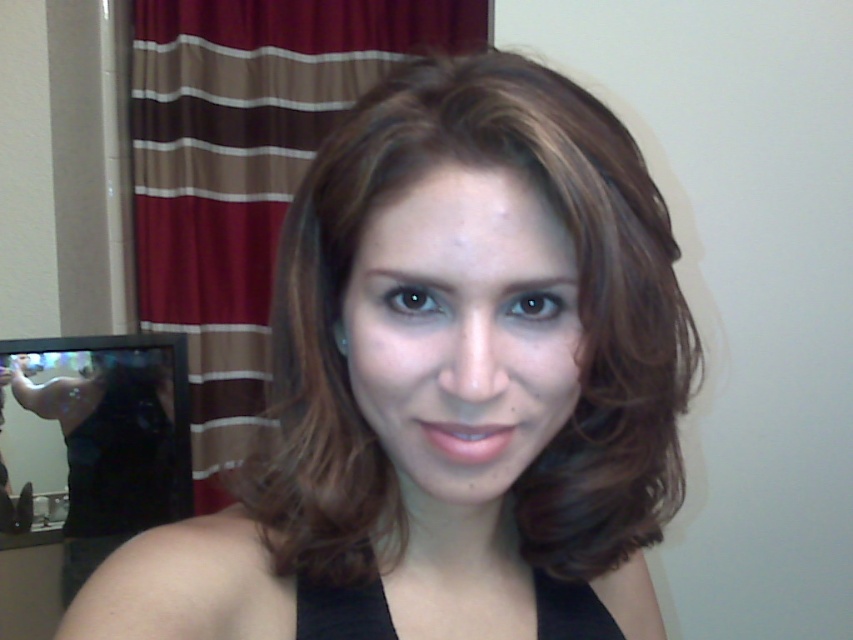
Question: Is brown striped curtain at upper center bigger than black satin dress at center?

Choices:
 (A) no
 (B) yes

Answer: (B)

Question: Among these objects, which one is nearest to the camera?

Choices:
 (A) matte black hair at center
 (B) black reflective mirror at left
 (C) black satin dress at lower left
 (D) brown striped curtain at upper center

Answer: (A)

Question: Which of the following is the closest to the observer?

Choices:
 (A) black satin dress at center
 (B) matte black hair at center
 (C) black satin dress at lower left

Answer: (B)

Question: Is brown striped curtain at upper center below black satin dress at center?

Choices:
 (A) yes
 (B) no

Answer: (B)

Question: Does brown striped curtain at upper center have a smaller size compared to black satin dress at center?

Choices:
 (A) no
 (B) yes

Answer: (A)

Question: Which point is farther to the camera?

Choices:
 (A) black satin dress at lower left
 (B) brown striped curtain at upper center
 (C) black reflective mirror at left

Answer: (B)